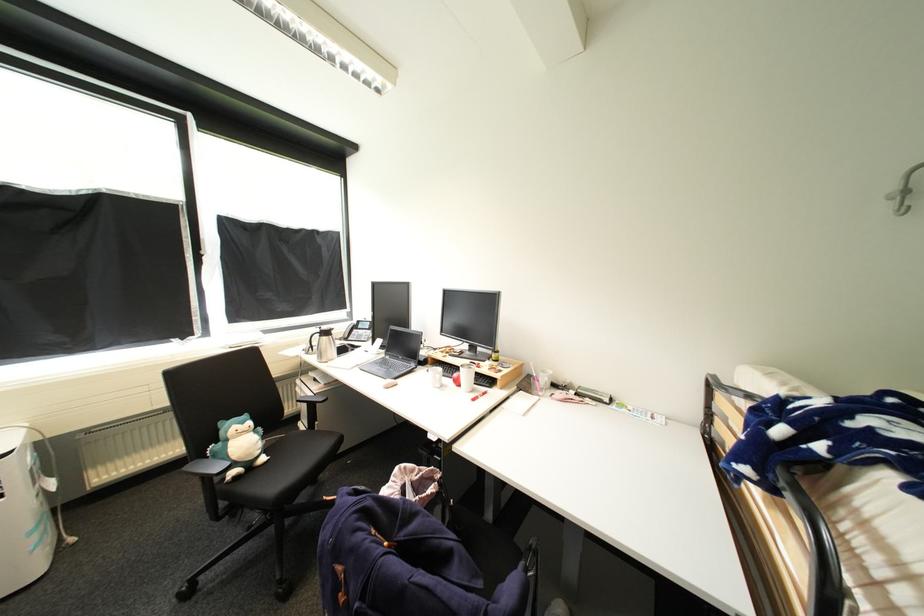
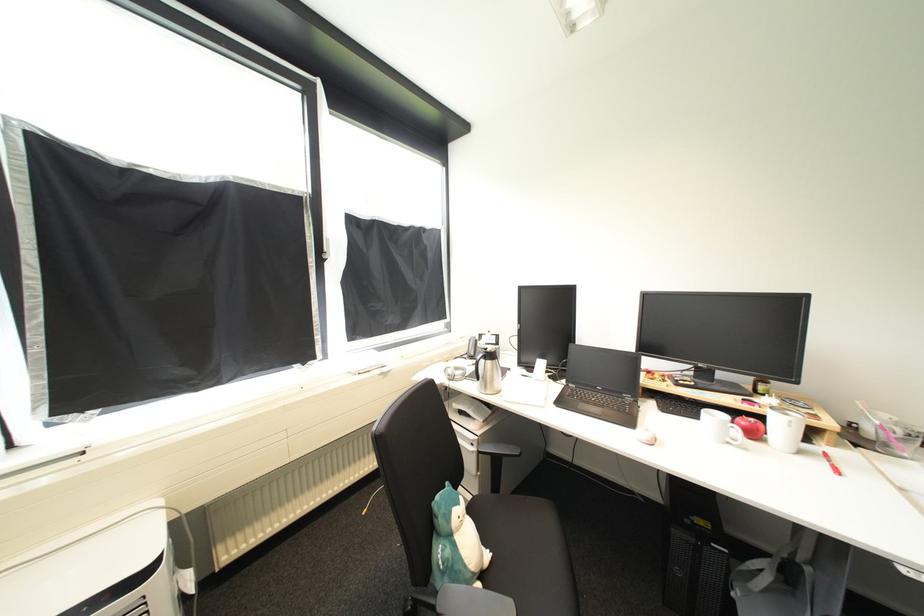
The point at (466, 384) is marked in the first image. Where is the corresponding point in the second image?

(761, 436)